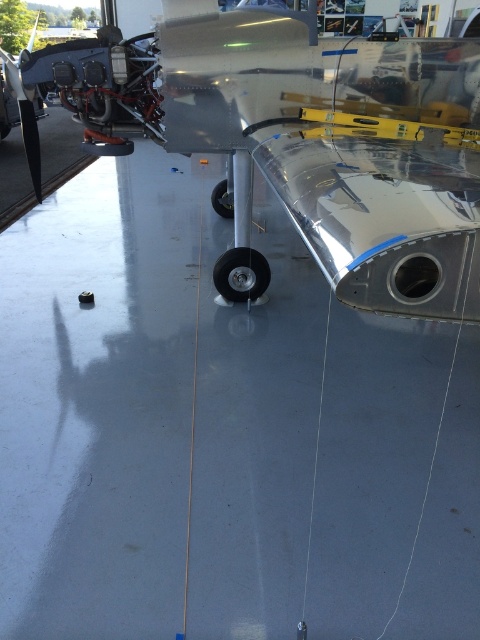
Does metallic silver airplane at center have a lesser height compared to brushed metal propeller at left?

Indeed, metallic silver airplane at center has a lesser height compared to brushed metal propeller at left.

Does point (158, 49) come behind point (32, 104)?

No, (158, 49) is in front of (32, 104).

Which is in front, point (446, 84) or point (20, 96)?

Point (446, 84)

The width and height of the screenshot is (480, 640). I want to click on metallic silver airplane at center, so click(295, 138).